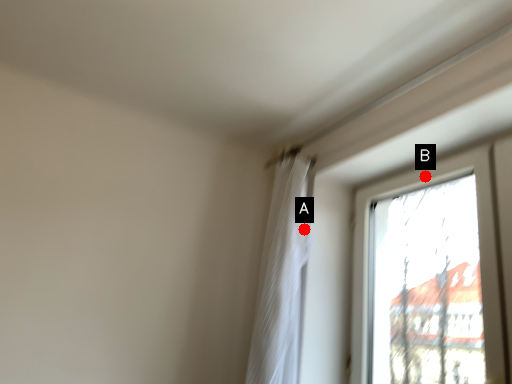
Question: Two points are circled on the image, labeled by A and B beside each circle. Which point is closer to the camera taking this photo?

Choices:
 (A) A is closer
 (B) B is closer

Answer: (B)